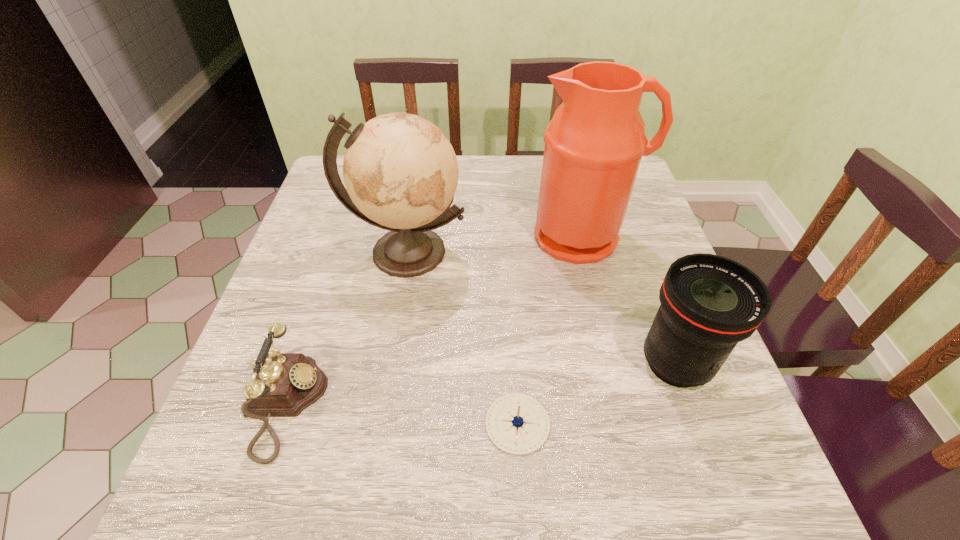
Identify the location of free area in between the compass and the fourth tallest object. This screenshot has width=960, height=540. (401, 414).

The image size is (960, 540). I want to click on object that is the second closest to the telephoto lens, so 594,143.

Find the location of `object that stands as the closest to the globe`. object that stands as the closest to the globe is located at coordinates (594, 143).

At what (x,y) coordinates should I click in order to perform the action: click on free space that satisfies the following two spatial constraints: 1. from the spout of the water jug; 2. on the dial of the telephone. Please return your answer as a coordinate pair (x, y). Looking at the image, I should click on (624, 404).

The height and width of the screenshot is (540, 960). I want to click on vacant area that satisfies the following two spatial constraints: 1. on the front-facing side of the globe; 2. on the dial of the telephone, so click(x=381, y=404).

In order to click on vacant space that satisfies the following two spatial constraints: 1. on the front-facing side of the globe; 2. on the dial of the telephone in this screenshot , I will do `click(381, 404)`.

Identify the location of vacant area in the image that satisfies the following two spatial constraints: 1. on the back side of the shortest object; 2. on the dial of the second shortest object. (516, 404).

Find the location of `blank space that satisfies the following two spatial constraints: 1. on the front-facing side of the globe; 2. on the right side of the telephoto lens`. blank space that satisfies the following two spatial constraints: 1. on the front-facing side of the globe; 2. on the right side of the telephoto lens is located at coordinates (388, 363).